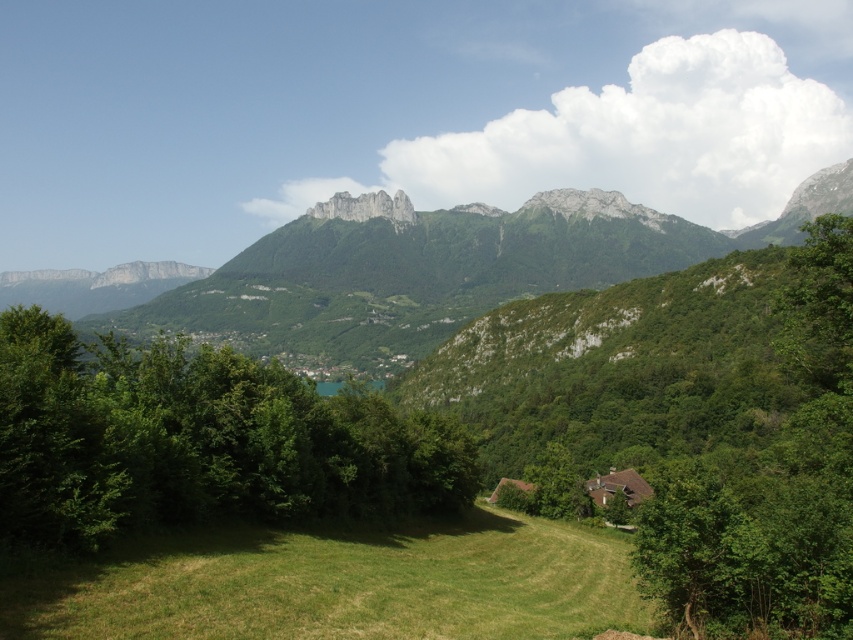
The image size is (853, 640). Describe the element at coordinates (198, 440) in the screenshot. I see `green leafy tree at center` at that location.

Between green leafy tree at center and green grassy field at lower center, which one is positioned lower?

green grassy field at lower center is lower down.

Identify the location of green leafy tree at center. (198, 440).

The height and width of the screenshot is (640, 853). In order to click on green leafy tree at center in this screenshot , I will do `click(198, 440)`.